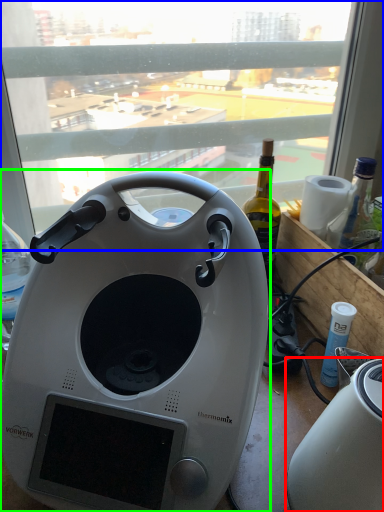
Question: Which object is the farthest from toaster (highlighted by a red box)? Choose among these: window (highlighted by a blue box) or home appliance (highlighted by a green box).

Choices:
 (A) window
 (B) home appliance

Answer: (A)